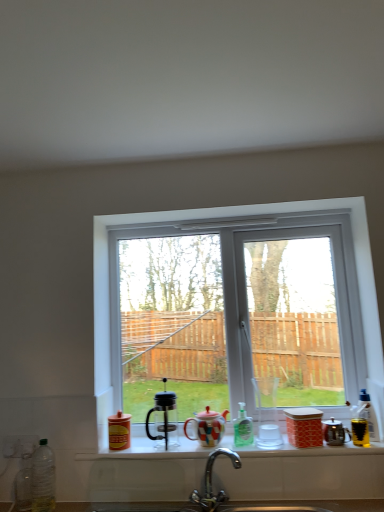
Question: Is matte ceramic teapot at center smaller than clear plastic bottle at lower left, placed as the 1th bottle when sorted from left to right?

Choices:
 (A) yes
 (B) no

Answer: (B)

Question: Considering the relative sizes of matte ceramic teapot at center and clear plastic bottle at lower left, placed as the 1th bottle when sorted from left to right, in the image provided, is matte ceramic teapot at center bigger than clear plastic bottle at lower left, placed as the 1th bottle when sorted from left to right,?

Choices:
 (A) yes
 (B) no

Answer: (A)

Question: From a real-world perspective, is matte ceramic teapot at center over clear plastic bottle at lower left, placed as the 1th bottle when sorted from left to right?

Choices:
 (A) yes
 (B) no

Answer: (A)

Question: Does matte ceramic teapot at center come behind clear plastic bottle at lower left, the 3th bottle when ordered from right to left?

Choices:
 (A) no
 (B) yes

Answer: (B)

Question: From the image's perspective, would you say matte ceramic teapot at center is shown under clear plastic bottle at lower left, placed as the 1th bottle when sorted from left to right?

Choices:
 (A) no
 (B) yes

Answer: (A)

Question: Does matte ceramic teapot at center have a lesser height compared to clear plastic bottle at lower left, the 3th bottle when ordered from right to left?

Choices:
 (A) no
 (B) yes

Answer: (B)

Question: Is matte glass window sill at center located within clear plastic bottle at lower left, placed as the 1th bottle when sorted from left to right?

Choices:
 (A) no
 (B) yes

Answer: (A)

Question: Is clear plastic bottle at lower left, placed as the 1th bottle when sorted from left to right, wider than matte glass window sill at center?

Choices:
 (A) no
 (B) yes

Answer: (A)

Question: Considering the relative sizes of clear plastic bottle at lower left, the 3th bottle when ordered from right to left, and matte glass window sill at center in the image provided, is clear plastic bottle at lower left, the 3th bottle when ordered from right to left, taller than matte glass window sill at center?

Choices:
 (A) no
 (B) yes

Answer: (B)

Question: Is clear plastic bottle at lower left, placed as the 1th bottle when sorted from left to right, outside of matte glass window sill at center?

Choices:
 (A) yes
 (B) no

Answer: (A)

Question: Is the depth of clear plastic bottle at lower left, the 3th bottle when ordered from right to left, greater than that of matte glass window sill at center?

Choices:
 (A) yes
 (B) no

Answer: (B)

Question: Is clear plastic bottle at lower left, placed as the 1th bottle when sorted from left to right, facing towards matte glass window sill at center?

Choices:
 (A) yes
 (B) no

Answer: (B)

Question: Is the position of yellow plastic bottle at right, which appears as the third bottle when viewed from the left, more distant than that of polished chrome faucet at lower center?

Choices:
 (A) yes
 (B) no

Answer: (A)